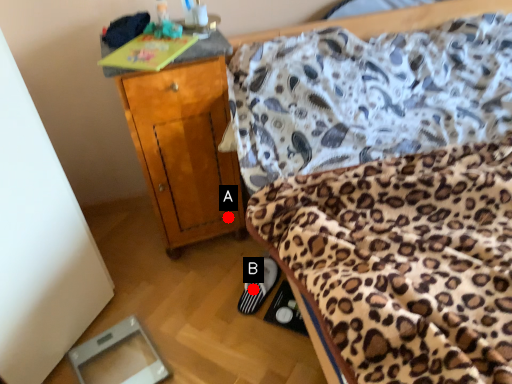
Question: Two points are circled on the image, labeled by A and B beside each circle. Which of the following is the farthest from the observer?

Choices:
 (A) A is further
 (B) B is further

Answer: (A)